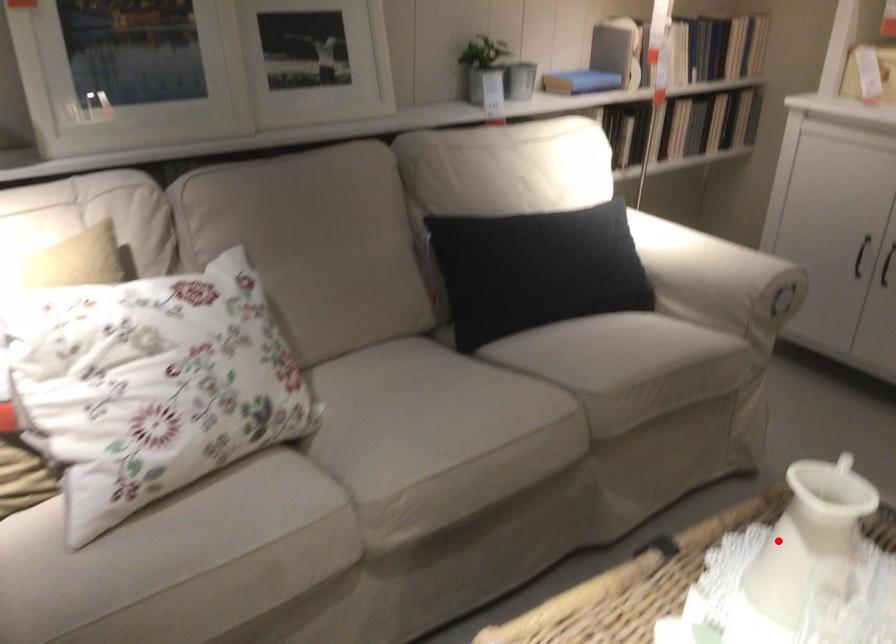
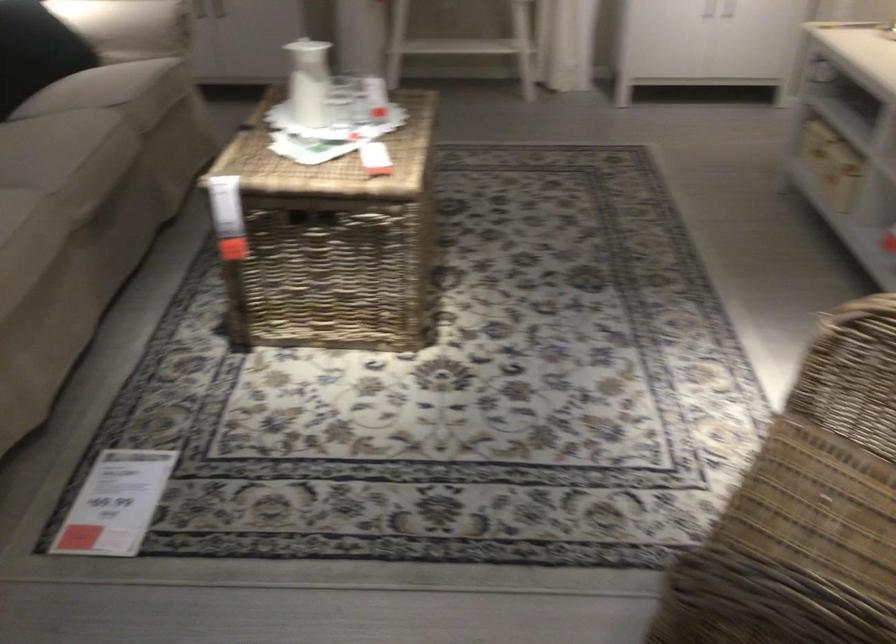
Where in the second image is the point corresponding to the highlighted location from the first image?

(308, 82)